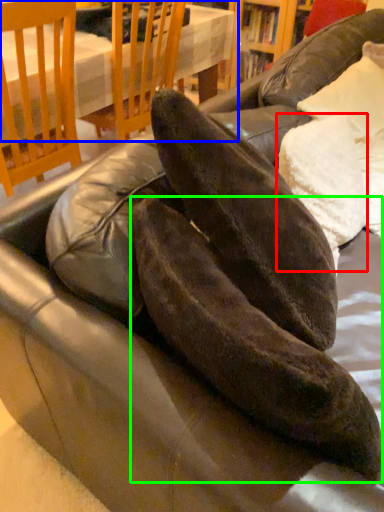
Question: Estimate the real-world distances between objects in this image. Which object is farther from pillow (highlighted by a red box), table (highlighted by a blue box) or leather shoe (highlighted by a green box)?

Choices:
 (A) table
 (B) leather shoe

Answer: (A)